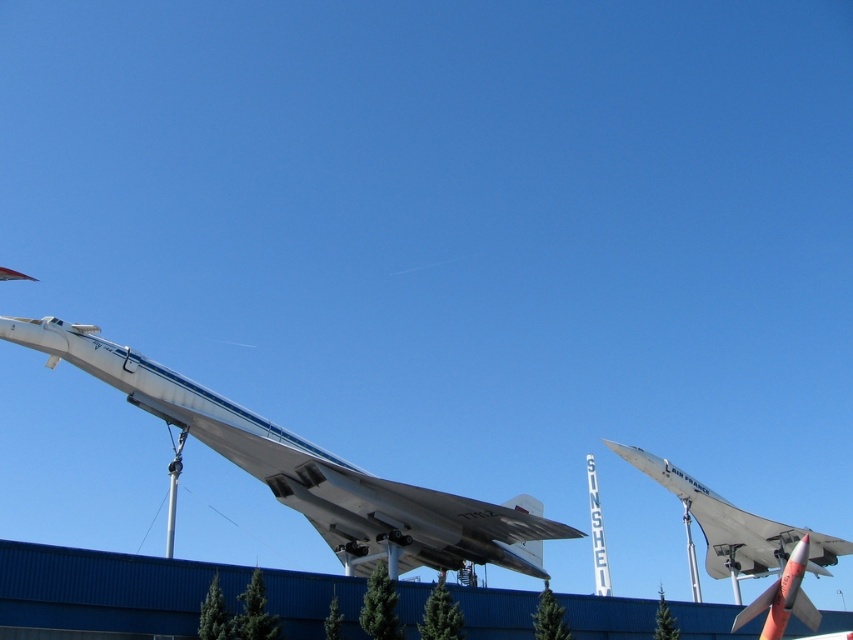
You are a visitor at an aviation museum and want to take a photo of both the white glossy airplane at center and the white glossy airplane at right. Since the museum has a height restriction of 2 meters, will you be able to capture both in your photo without any obstruction?

The white glossy airplane at center is located above the white glossy airplane at right. Since the height restriction is 2 meters, it depends on the total height of both airplanes combined. However, the description does not provide specific height measurements, so we cannot determine if they will fit within the 2 meter limit. Please check the actual dimensions at the museum.

In the scene shown: You are a museum curator planning to move both the white glossy airplane at center and the white glossy airplane at right to a new exhibition hall. The entrance of the hall has a doorway that is 3 meters wide. Can both airplanes fit through the doorway side by side if placed horizontally?

The white glossy airplane at center is bigger than the white glossy airplane at right. However, the exact dimensions of each airplane are not provided in the description. Without knowing their specific widths, it is impossible to determine if they can fit through the 3 meter wide doorway side by side.

Based on the photo, you are standing at the camera position and want to take a photo of the white glossy airplane at center. The camera has a maximum focus range of 50 meters. Will you be able to focus on the airplane?

The white glossy airplane at center and camera are 52.47 meters apart from each other, which exceeds the camera maximum focus range of 50 meters. Therefore, the camera cannot focus on the airplane.